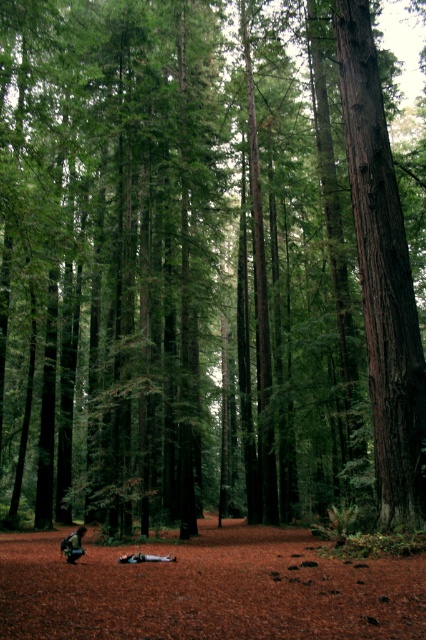
Question: Which object appears closest to the camera in this image?

Choices:
 (A) dark green fabric backpack at lower left
 (B) light blue fabric at lower center

Answer: (A)

Question: Is dark green fabric backpack at lower left wider than light blue fabric at lower center?

Choices:
 (A) no
 (B) yes

Answer: (B)

Question: Among these points, which one is nearest to the camera?

Choices:
 (A) (83, 550)
 (B) (149, 554)

Answer: (A)

Question: Does dark green fabric backpack at lower left lie behind light blue fabric at lower center?

Choices:
 (A) yes
 (B) no

Answer: (B)

Question: Can you confirm if dark green fabric backpack at lower left is positioned above light blue fabric at lower center?

Choices:
 (A) no
 (B) yes

Answer: (A)

Question: Which point appears closest to the camera in this image?

Choices:
 (A) (143, 556)
 (B) (78, 532)

Answer: (A)